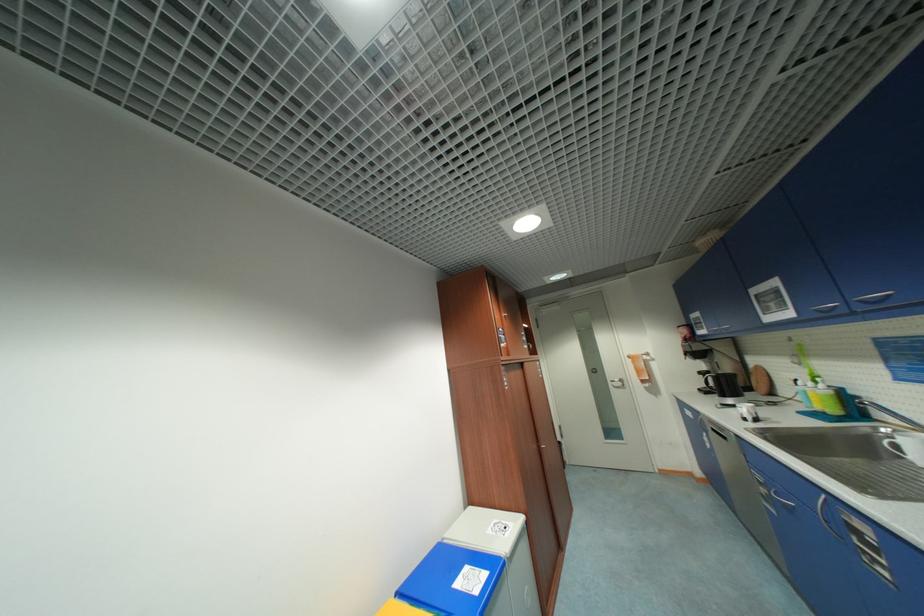
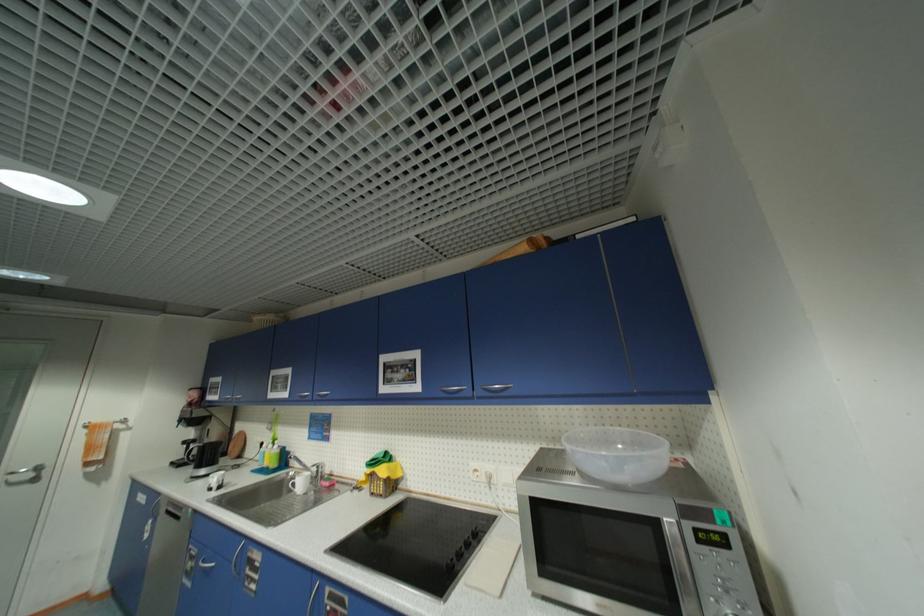
Where in the second image is the point corresponding to (768,491) from the first image?

(196, 565)